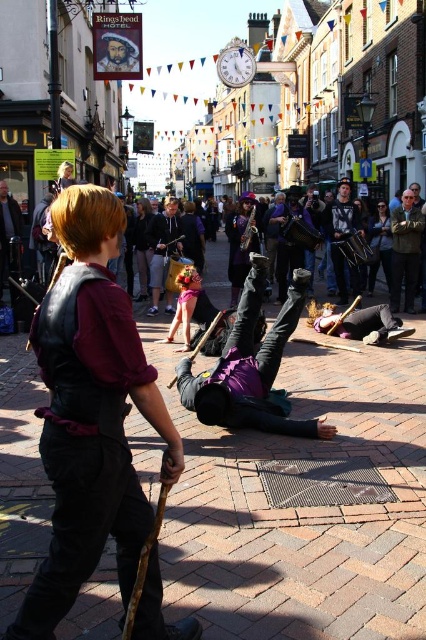
Between point (45, 577) and point (233, 70), which one is positioned in front?

Point (45, 577)

Does leather vest at center appear under metallic silver clock at upper center?

Indeed, leather vest at center is positioned under metallic silver clock at upper center.

Locate an element on the screen. leather vest at center is located at coordinates tap(91, 413).

Does suede jacket at right appear on the left side of matte black camera at center?

Incorrect, suede jacket at right is not on the left side of matte black camera at center.

Who is higher up, suede jacket at right or matte black camera at center?

matte black camera at center is higher up.

This screenshot has width=426, height=640. What do you see at coordinates (405, 250) in the screenshot? I see `suede jacket at right` at bounding box center [405, 250].

You are a GUI agent. You are given a task and a screenshot of the screen. Output one action in this format:
    pyautogui.click(x=<x>, y=<y>)
    Task: Click on the suede jacket at right
    
    Given the screenshot: What is the action you would take?
    pyautogui.click(x=405, y=250)

Which is more to the right, suede jacket at right or dark brown leather jacket at center?

suede jacket at right is more to the right.

Who is higher up, suede jacket at right or dark brown leather jacket at center?

dark brown leather jacket at center is above.

Which is behind, point (397, 236) or point (164, 225)?

Positioned behind is point (164, 225).

At what (x,y) coordinates should I click in order to perform the action: click on suede jacket at right. Please return your answer as a coordinate pair (x, y). This screenshot has width=426, height=640. Looking at the image, I should click on (405, 250).